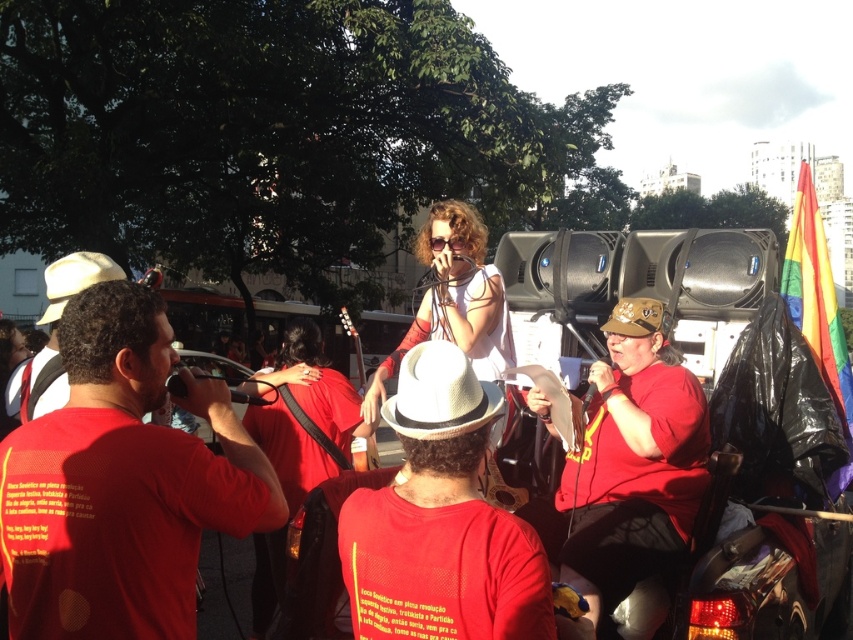
You are at a public event and see the matte red shirt at center and the white straw cowboy hat at center. Which object is positioned more to the left?

The matte red shirt at center is positioned to the left of the white straw cowboy hat at center, so it is more to the left.

From the picture: You are a photographer at the event and want to capture both the white straw hat at center and the white straw cowboy hat at center in a single photo. Which hat will appear larger in the photo?

The white straw hat at center will appear larger in the photo because it is much taller than the white straw cowboy hat at center.